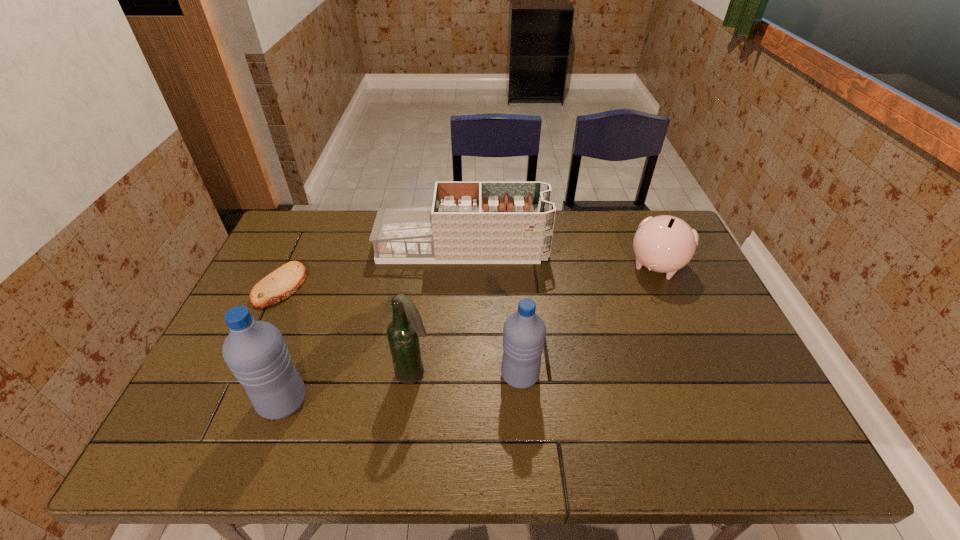
Please point a vacant point for placing a water bottle on the right. Please provide its 2D coordinates. Your answer should be formatted as a tuple, i.e. [(x, y)], where the tuple contains the x and y coordinates of a point satisfying the conditions above.

[(735, 352)]